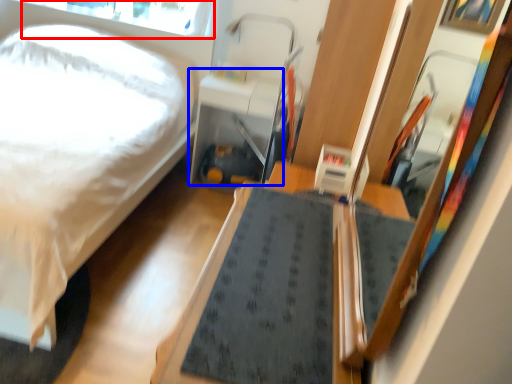
Question: Which object is further to the camera taking this photo, window screen (highlighted by a red box) or table (highlighted by a blue box)?

Choices:
 (A) window screen
 (B) table

Answer: (A)